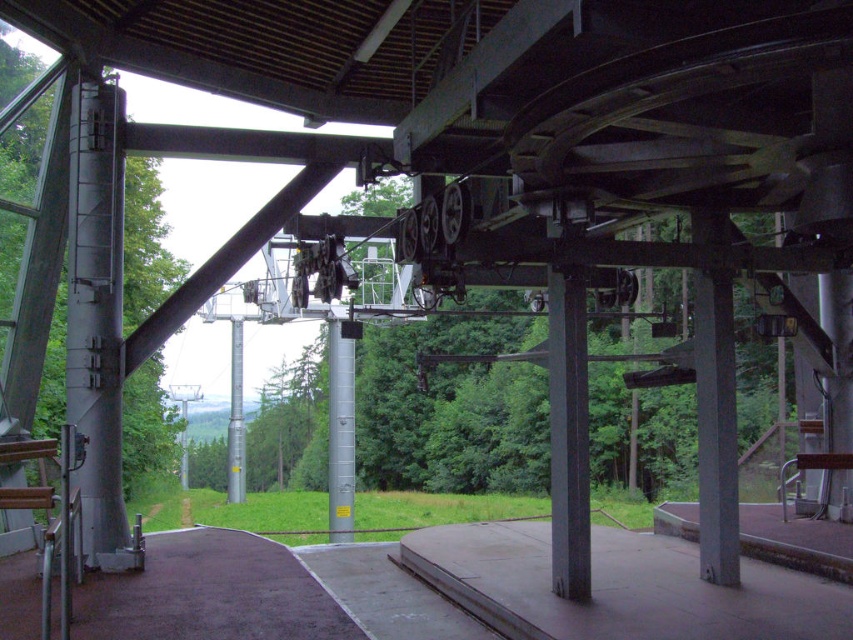
You are standing inside the ski lift station and looking out through the open doorway. There is a silver metallic pole at center. Where is the point at coordinate (340, 435) located?

The point at coordinate (340, 435) is located on the silver metallic pole at center.